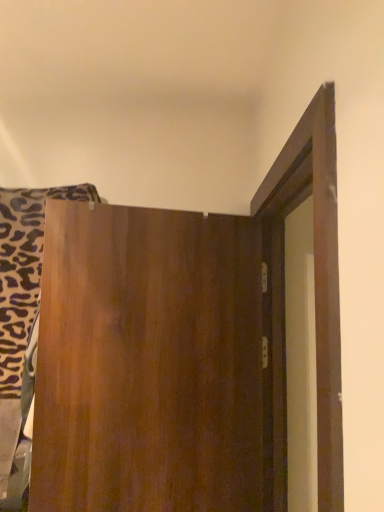
Question: From a real-world perspective, is wooden door at center positioned above or below wooden board at left?

Choices:
 (A) above
 (B) below

Answer: (B)

Question: Looking at the image, does wooden door at center seem bigger or smaller compared to wooden board at left?

Choices:
 (A) small
 (B) big

Answer: (B)

Question: In the image, is wooden door at center positioned in front of or behind wooden board at left?

Choices:
 (A) front
 (B) behind

Answer: (A)

Question: From the image's perspective, relative to wooden door at center, is wooden board at left above or below?

Choices:
 (A) below
 (B) above

Answer: (B)

Question: Considering the positions of point (26, 445) and point (120, 433), is point (26, 445) closer or farther from the camera than point (120, 433)?

Choices:
 (A) closer
 (B) farther

Answer: (B)

Question: Visually, is wooden board at left positioned to the left or to the right of wooden door at center?

Choices:
 (A) left
 (B) right

Answer: (A)

Question: From a real-world perspective, is wooden board at left physically located above or below wooden door at center?

Choices:
 (A) above
 (B) below

Answer: (A)